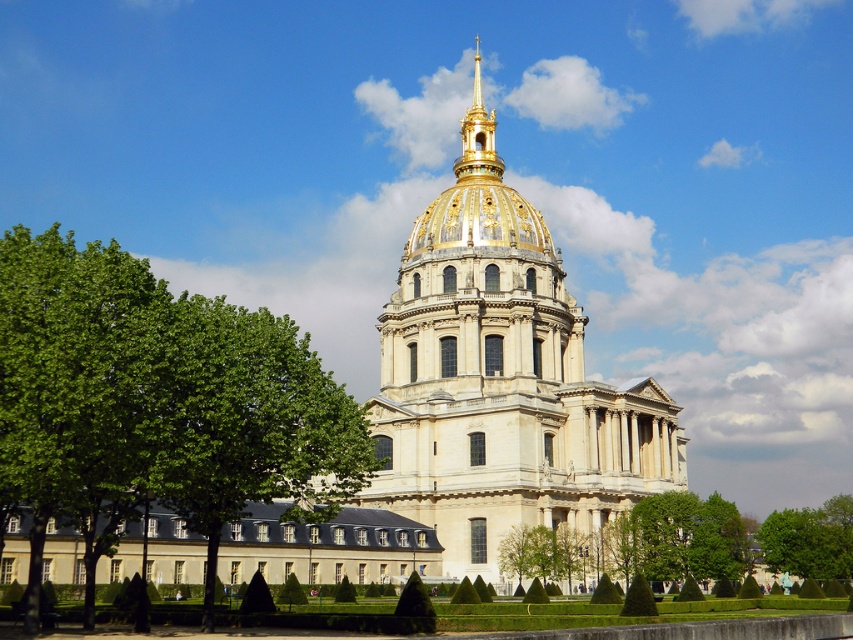
You are a landscape architect planning to add more trees to the area. Given the green leafy tree at left and the green leafy tree at lower right, which tree has a larger width that you should consider for spacing?

The green leafy tree at left has a larger width than the green leafy tree at lower right, so you should consider its width when planning spacing to ensure adequate space for growth and aesthetics.

You are a landscape architect planning to plant a new tree that requires at least 15 meters of space from any building. Given the green leafy tree at left and the golden dome building at center, can you plant the new tree between them without violating the spacing requirement?

The green leafy tree at left is 17.77 meters away from the golden dome building at center. Since the required distance is at least 15 meters, planting a new tree between them would maintain the necessary spacing as the existing distance already exceeds the minimum requirement.